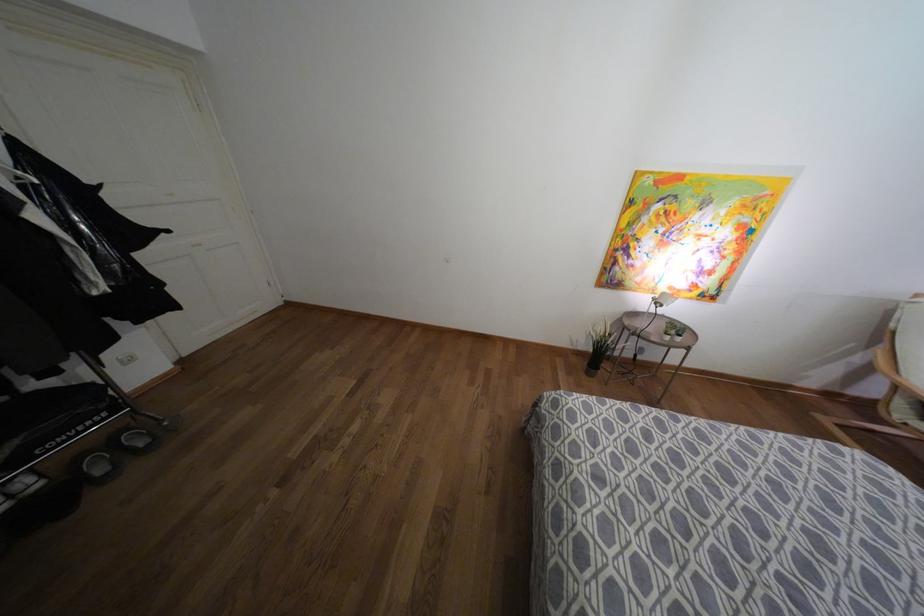
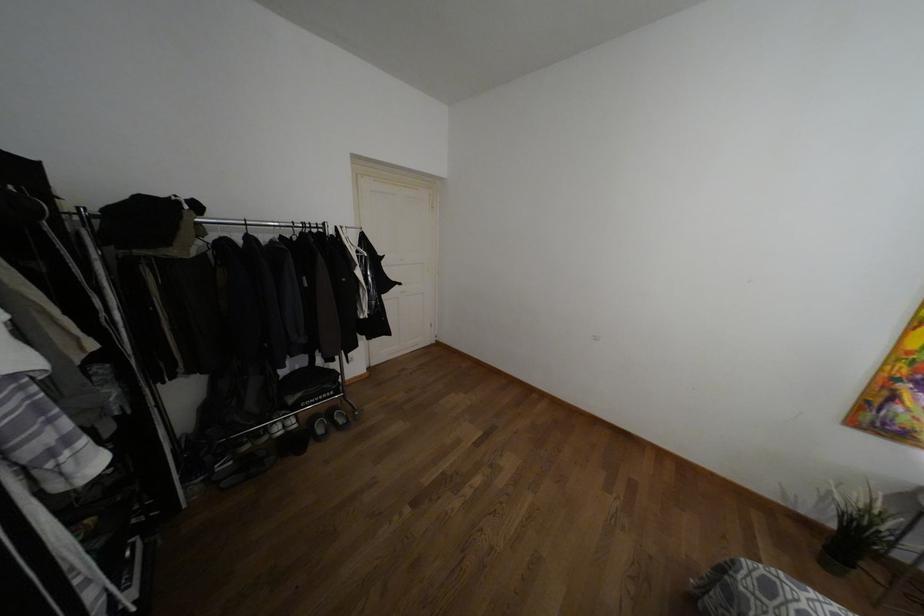
Question: How did the camera likely rotate?

Choices:
 (A) Left
 (B) Right
 (C) Up
 (D) Down

Answer: (A)